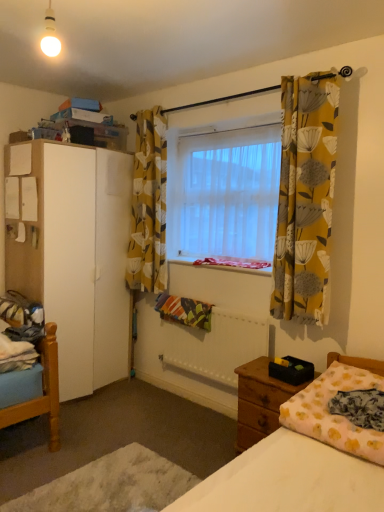
What are the coordinates of `vacant space positioned to the left of wooden nightstand at lower right` in the screenshot? It's located at (202, 448).